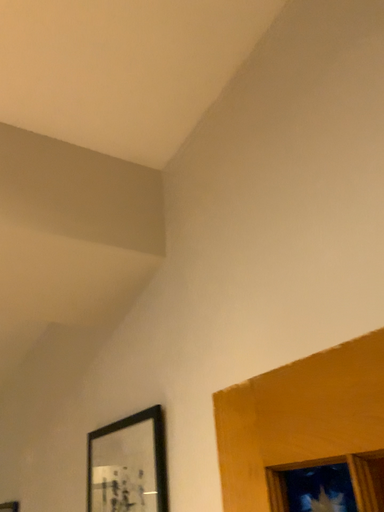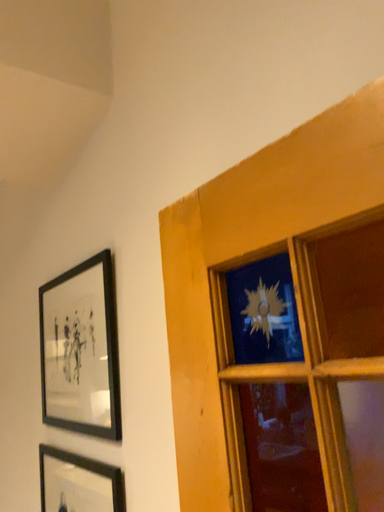
Question: Which way did the camera rotate in the video?

Choices:
 (A) rotated upward
 (B) rotated downward

Answer: (B)